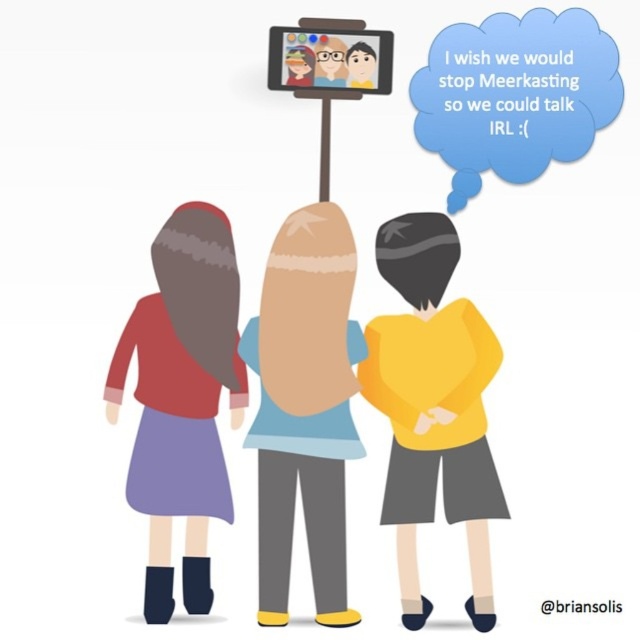
You are a teacher trying to see the screen during a virtual class. You notice the yellow matte shirt at center and the matte plastic tablet at upper center. Which object is blocking your view of the tablet?

The yellow matte shirt at center is in front of the matte plastic tablet at upper center, so it is blocking the view of the tablet.

You are a character in the image and you want to point to the blue paper speech bubble at upper center. Which direction should you turn from the matte red sweater at left to face it?

The matte red sweater at left is positioned on the left side of the blue paper speech bubble at upper center, so you should turn to the right to face it.

You are a character in the image and you want to read the text in the blue paper speech bubble at upper center. Can you see it clearly while standing behind the matte red sweater at left?

The matte red sweater at left is in front of the blue paper speech bubble at upper center, so you cannot see the text in the blue paper speech bubble at upper center clearly while standing behind the matte red sweater at left.